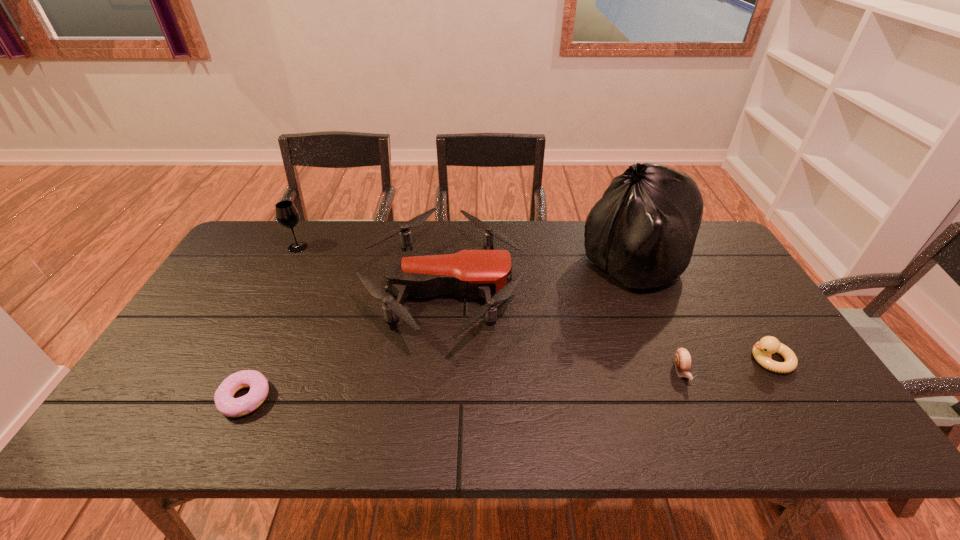
Find the location of a particular element. free space between the second shortest object and the tallest object is located at coordinates (658, 319).

Locate an element on the screen. The height and width of the screenshot is (540, 960). empty location between the doughnut and the wineglass is located at coordinates (272, 323).

You are a GUI agent. You are given a task and a screenshot of the screen. Output one action in this format:
    pyautogui.click(x=<x>, y=<y>)
    Task: Click on the free space between the escargot and the duckling
    
    Given the screenshot: What is the action you would take?
    pyautogui.click(x=726, y=366)

Identify the location of empty space that is in between the shortest object and the fifth shortest object. (272, 323).

Identify the location of vacant area between the doughnut and the wineglass. (272, 323).

At what (x,y) coordinates should I click in order to perform the action: click on free spot between the second shortest object and the third shortest object. Please return your answer as a coordinate pair (x, y). This screenshot has width=960, height=540. Looking at the image, I should click on (726, 366).

At what (x,y) coordinates should I click in order to perform the action: click on vacant space in between the duckling and the third object from left to right. Please return your answer as a coordinate pair (x, y). Looking at the image, I should click on (607, 324).

This screenshot has height=540, width=960. In order to click on free point between the escargot and the third shortest object in this screenshot , I will do `click(726, 366)`.

The width and height of the screenshot is (960, 540). What are the coordinates of `empty space between the shortest object and the plastic bag` in the screenshot? It's located at (440, 332).

Locate which object ranks second in proximity to the second tallest object. Please provide its 2D coordinates. Your answer should be formatted as a tuple, i.e. [(x, y)], where the tuple contains the x and y coordinates of a point satisfying the conditions above.

[(225, 403)]